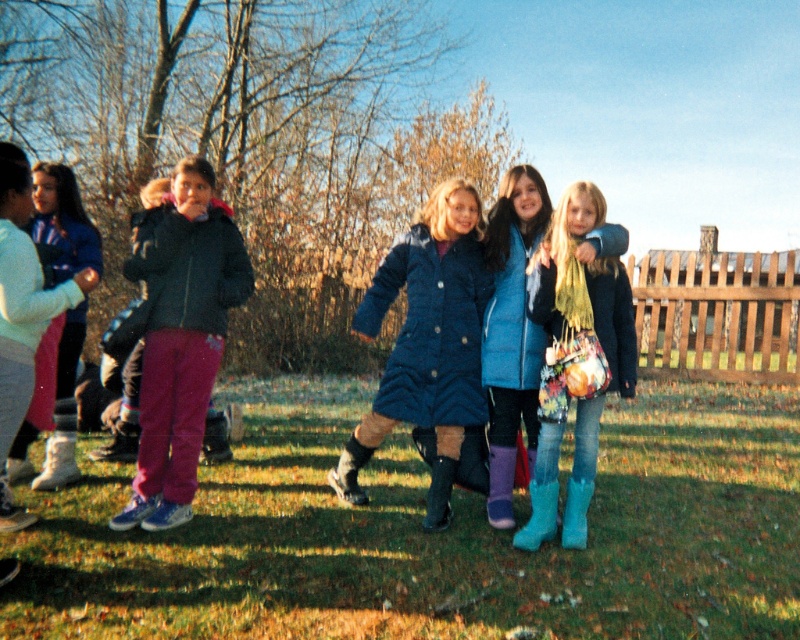
Does quilted blue coat at center have a smaller size compared to matte black coat at left?

Actually, quilted blue coat at center might be larger than matte black coat at left.

Describe the element at coordinates (430, 330) in the screenshot. The width and height of the screenshot is (800, 640). I see `quilted blue coat at center` at that location.

Image resolution: width=800 pixels, height=640 pixels. What do you see at coordinates (430, 330) in the screenshot?
I see `quilted blue coat at center` at bounding box center [430, 330].

Find the location of a particular element. This screenshot has width=800, height=640. quilted blue coat at center is located at coordinates (430, 330).

Who is taller, matte black jacket at left or matte black boot at center?

matte black jacket at left is taller.

Between matte black jacket at left and matte black boot at center, which one appears on the left side from the viewer's perspective?

matte black jacket at left is more to the left.

Is point (220, 253) less distant than point (432, 490)?

Yes.

You are a GUI agent. You are given a task and a screenshot of the screen. Output one action in this format:
    pyautogui.click(x=<x>, y=<y>)
    Task: Click on the matte black jacket at left
    
    Given the screenshot: What is the action you would take?
    pyautogui.click(x=180, y=337)

Is green grass at lower center further to camera compared to white suede boot at lower left?

No, it is in front of white suede boot at lower left.

Measure the distance between green grass at lower center and white suede boot at lower left.

green grass at lower center and white suede boot at lower left are 1.68 meters apart from each other.

Who is more distant from viewer, (x=704, y=484) or (x=40, y=476)?

The point (x=704, y=484) is more distant.

Find the location of a particular element. green grass at lower center is located at coordinates (434, 534).